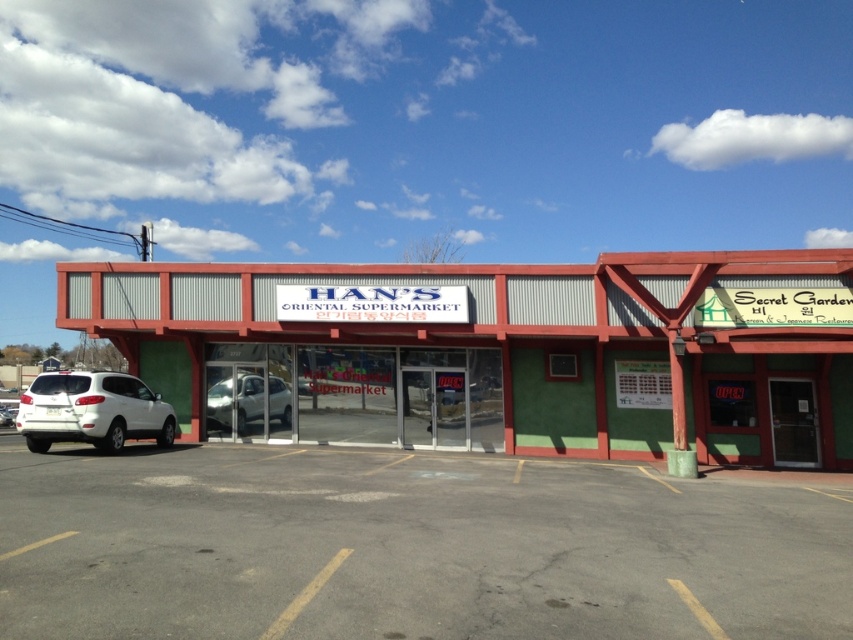
Question: Which point is farther to the camera?

Choices:
 (A) white matte car at center
 (B) green corrugated metal building at center

Answer: (A)

Question: Among these objects, which one is nearest to the camera?

Choices:
 (A) green corrugated metal building at center
 (B) white matte car at center
 (C) white matte suv at lower left
 (D) gray asphalt parking lot at center

Answer: (D)

Question: Can you confirm if white matte suv at lower left is wider than white matte car at center?

Choices:
 (A) no
 (B) yes

Answer: (B)

Question: Can you confirm if white matte suv at lower left is smaller than white matte car at center?

Choices:
 (A) yes
 (B) no

Answer: (B)

Question: Is gray asphalt parking lot at center closer to the viewer compared to white matte suv at lower left?

Choices:
 (A) no
 (B) yes

Answer: (B)

Question: Which object appears farthest from the camera in this image?

Choices:
 (A) green corrugated metal building at center
 (B) white matte suv at lower left
 (C) gray asphalt parking lot at center
 (D) white matte car at center

Answer: (D)